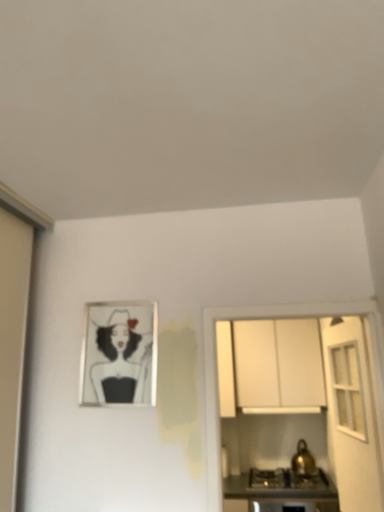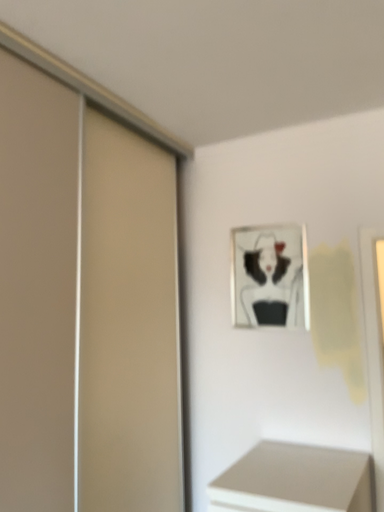
Question: How did the camera likely rotate when shooting the video?

Choices:
 (A) rotated right
 (B) rotated left

Answer: (B)